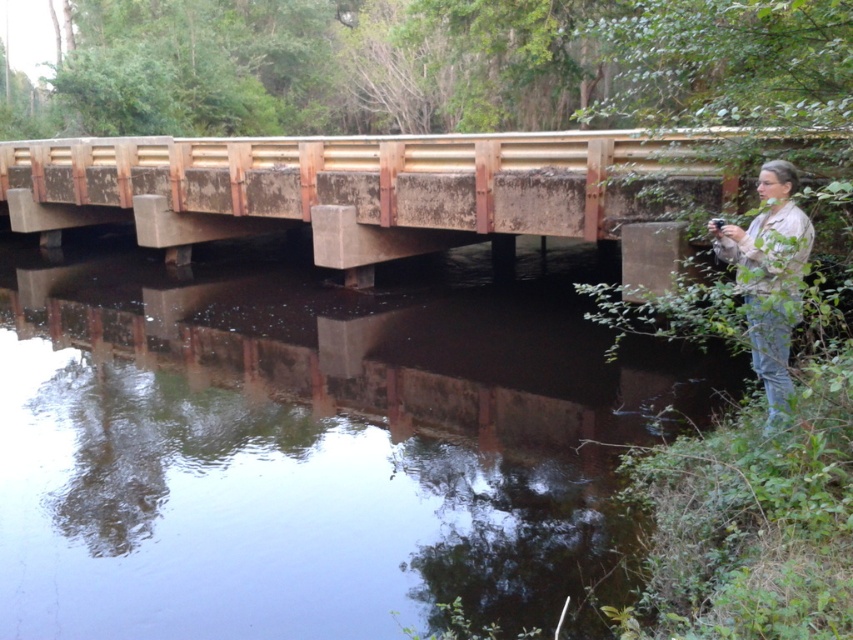
Does brown concrete river at lower center appear on the right side of tan fabric jacket at right?

No, brown concrete river at lower center is not to the right of tan fabric jacket at right.

Does brown concrete river at lower center have a smaller size compared to tan fabric jacket at right?

Incorrect, brown concrete river at lower center is not smaller in size than tan fabric jacket at right.

The image size is (853, 640). Describe the element at coordinates (309, 440) in the screenshot. I see `brown concrete river at lower center` at that location.

Find the location of a particular element. This screenshot has height=640, width=853. brown concrete river at lower center is located at coordinates (309, 440).

Which is in front, point (44, 216) or point (770, 275)?

Point (770, 275) is in front.

Is rusty concrete bridge at center bigger than tan fabric jacket at right?

Indeed, rusty concrete bridge at center has a larger size compared to tan fabric jacket at right.

Between point (722, 186) and point (755, 340), which one is positioned in front?

Positioned in front is point (755, 340).

At what (x,y) coordinates should I click in order to perform the action: click on rusty concrete bridge at center. Please return your answer as a coordinate pair (x, y). The width and height of the screenshot is (853, 640). Looking at the image, I should click on (361, 186).

Can you confirm if brown concrete river at lower center is bigger than rusty concrete bridge at center?

No, brown concrete river at lower center is not bigger than rusty concrete bridge at center.

Can you confirm if brown concrete river at lower center is wider than rusty concrete bridge at center?

No.

Identify the location of brown concrete river at lower center. The width and height of the screenshot is (853, 640). (309, 440).

Where is `brown concrete river at lower center`? The width and height of the screenshot is (853, 640). brown concrete river at lower center is located at coordinates (309, 440).